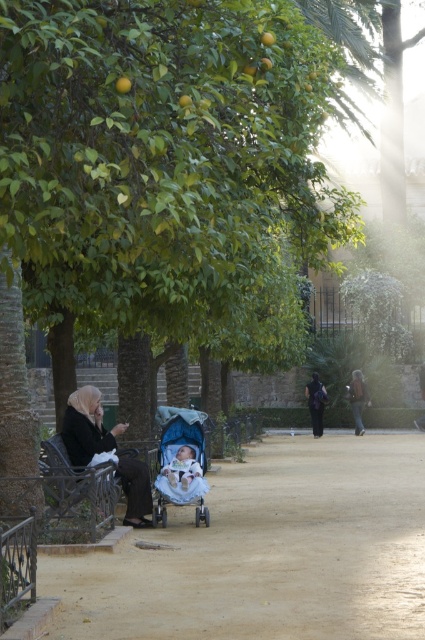
Between blue fabric stroller at center and black fabric person at center, which one appears on the left side from the viewer's perspective?

From the viewer's perspective, blue fabric stroller at center appears more on the left side.

Does blue fabric stroller at center come in front of black fabric person at center?

Yes, it is in front of black fabric person at center.

Between point (172, 502) and point (314, 376), which one is positioned in front?

Point (172, 502)

Where is `blue fabric stroller at center`? This screenshot has width=425, height=640. blue fabric stroller at center is located at coordinates (181, 461).

Who is positioned more to the right, smooth blue stroller at center or black wrought iron bench at lower left?

smooth blue stroller at center is more to the right.

Is point (212, 512) positioned behind point (90, 524)?

That is True.

Locate an element on the screen. This screenshot has width=425, height=640. smooth blue stroller at center is located at coordinates (268, 552).

Identify the location of smooth blue stroller at center. (268, 552).

Does smooth blue stroller at center appear on the left side of dark brown leather jacket at right?

Correct, you'll find smooth blue stroller at center to the left of dark brown leather jacket at right.

Looking at this image, which of these two, smooth blue stroller at center or dark brown leather jacket at right, stands taller?

Standing taller between the two is dark brown leather jacket at right.

Locate an element on the screen. smooth blue stroller at center is located at coordinates (268, 552).